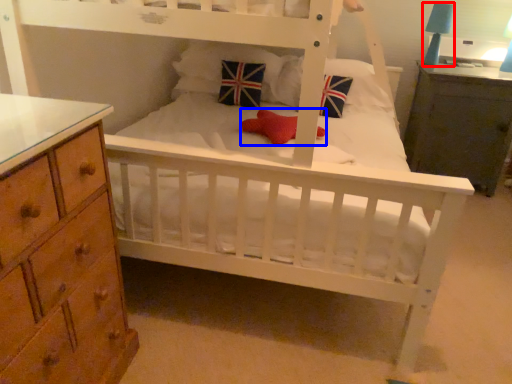
Question: Which object is further to the camera taking this photo, table lamp (highlighted by a red box) or toy (highlighted by a blue box)?

Choices:
 (A) table lamp
 (B) toy

Answer: (A)